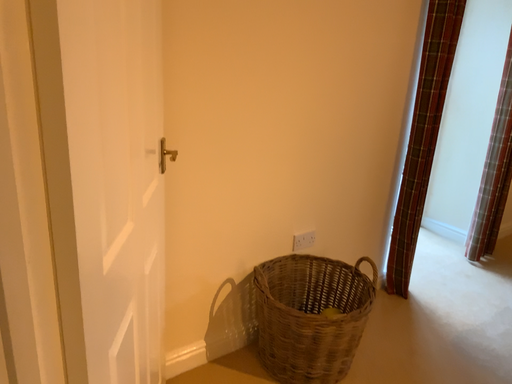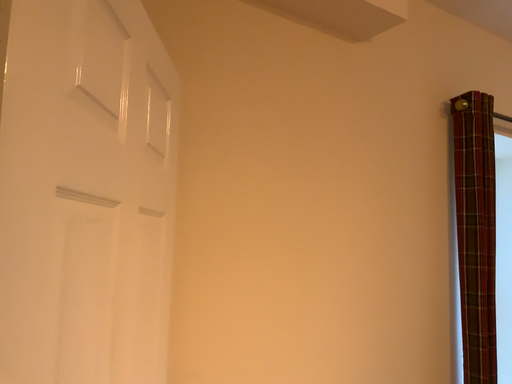
Question: How did the camera likely rotate when shooting the video?

Choices:
 (A) rotated downward
 (B) rotated upward

Answer: (B)